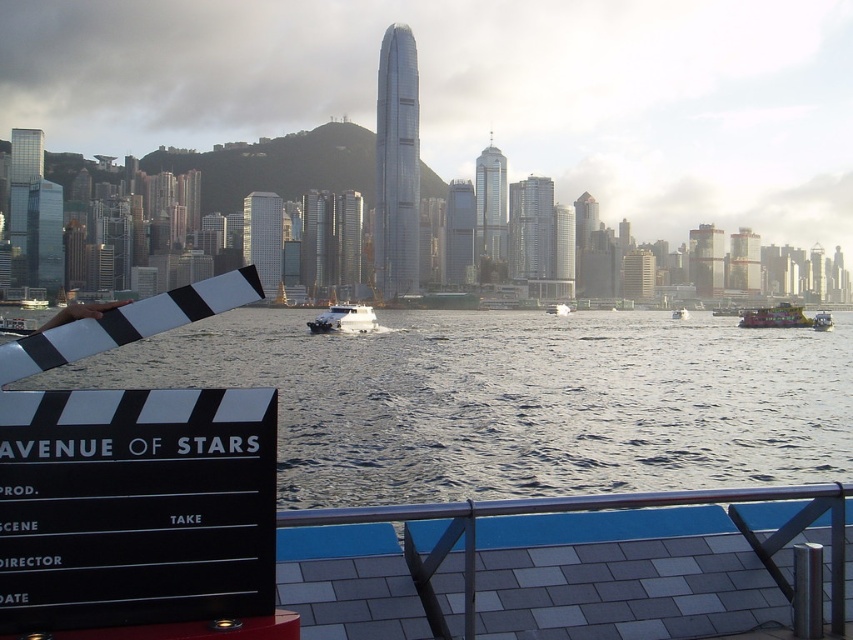
Can you confirm if green plastic boat at center is wider than metallic silver boat at center?

Correct, the width of green plastic boat at center exceeds that of metallic silver boat at center.

I want to click on green plastic boat at center, so click(822, 321).

Who is positioned more to the right, black matte clapperboard at lower left or white plastic boat at center?

Positioned to the right is white plastic boat at center.

Is point (503, 36) closer to camera compared to point (676, 317)?

No, it is not.

Image resolution: width=853 pixels, height=640 pixels. In order to click on black matte clapperboard at lower left in this screenshot , I will do `click(480, 93)`.

Between clear water at center and metallic silver boat at center, which one has more height?

Standing taller between the two is clear water at center.

Between clear water at center and metallic silver boat at center, which one appears on the right side from the viewer's perspective?

metallic silver boat at center

Who is more forward, (482, 410) or (555, 314)?

Positioned in front is point (482, 410).

You are a GUI agent. You are given a task and a screenshot of the screen. Output one action in this format:
    pyautogui.click(x=<x>, y=<y>)
    Task: Click on the clear water at center
    The image size is (853, 640).
    Given the screenshot: What is the action you would take?
    pyautogui.click(x=515, y=401)